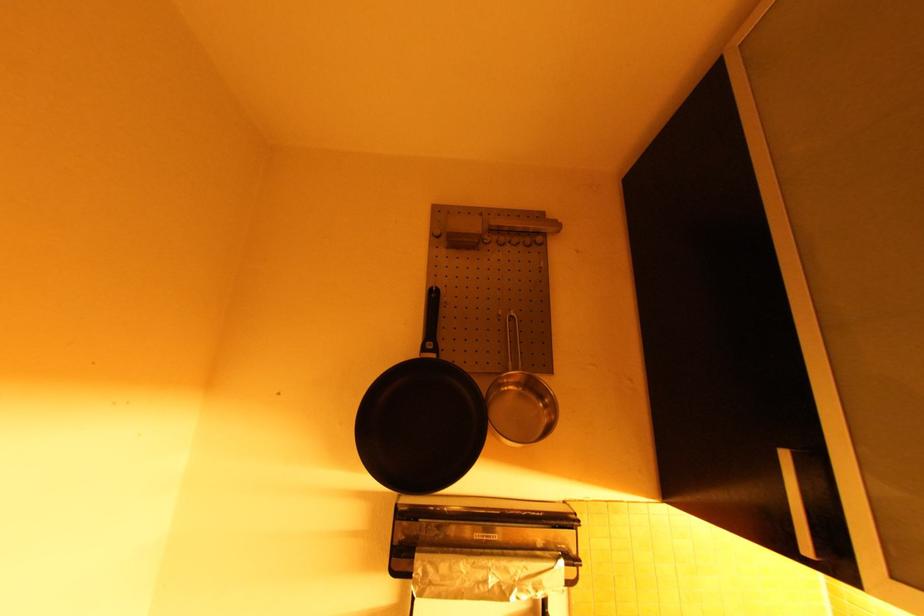
The image size is (924, 616). I want to click on cabinet handle, so click(796, 504).